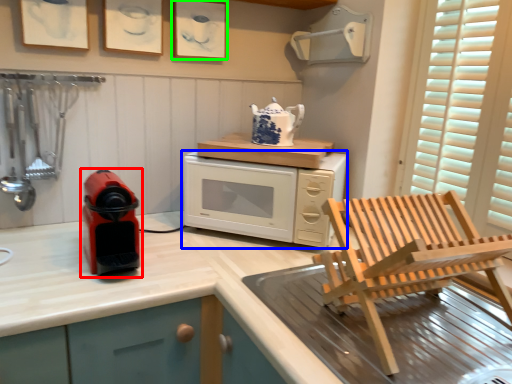
Question: Considering the real-world distances, which object is closest to home appliance (highlighted by a red box)? microwave oven (highlighted by a blue box) or picture frame (highlighted by a green box).

Choices:
 (A) microwave oven
 (B) picture frame

Answer: (A)